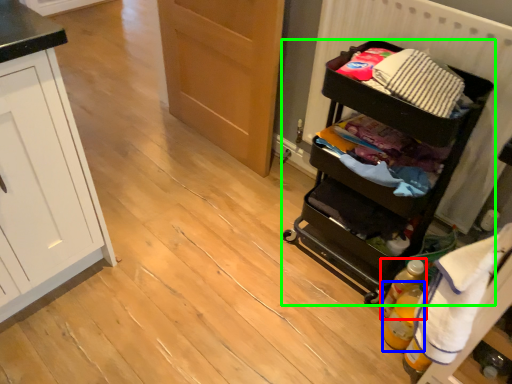
Question: Which object is the closest to the bottle (highlighted by a red box)? Choose among these: bottle (highlighted by a blue box) or furniture (highlighted by a green box).

Choices:
 (A) bottle
 (B) furniture

Answer: (A)